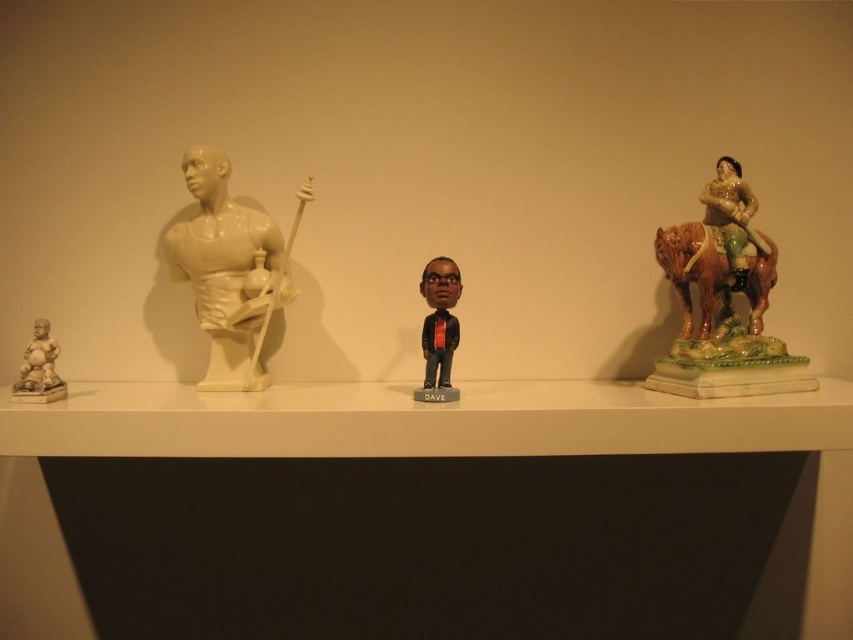
You are standing in front of the shelf and want to place a new figurine exactly at the point marked by coordinates point [723,300]. Which figurine is currently occupying that spot?

The point [723,300] corresponds to the multicolored ceramic horse rider at right, so that figurine is currently occupying that spot.

You are organizing a display and need to place a new item between the white glossy shelf at center and the glazed ceramic figure at right. Based on their positions, where should you place the new item to maintain symmetry?

To maintain symmetry, the new item should be placed between the white glossy shelf at center and the glazed ceramic figure at right, ensuring it is equidistant from both objects since the white glossy shelf at center is to the left of the glazed ceramic figure at right.

You are a photographer setting up a tripod to capture a closeup of the white glossy bust at center. The recommended minimum distance for your camera lens to avoid distortion is 4 feet. Based on the scene description, will you need to move the tripod closer or farther away to achieve the desired shot?

The distance between the white glossy bust at center and the camera is 3.81 feet, which is less than the recommended 4 feet. To avoid distortion, you should move the tripod farther away from the white glossy bust at center until it reaches the minimum safe distance.